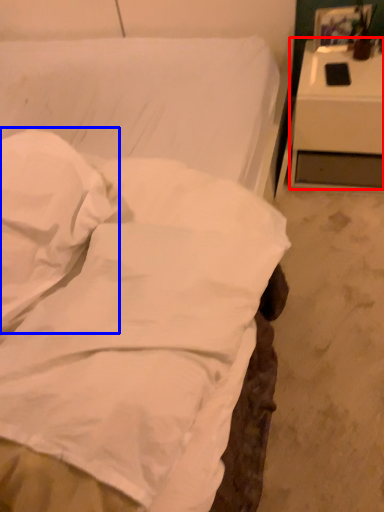
Question: Which point is closer to the camera, nightstand (highlighted by a red box) or pillow (highlighted by a blue box)?

Choices:
 (A) nightstand
 (B) pillow

Answer: (B)